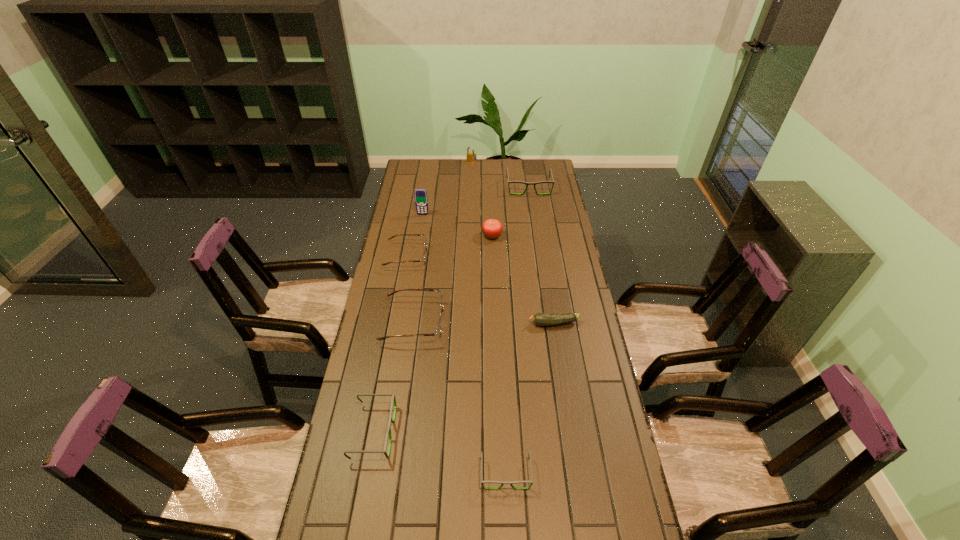
Locate which black spectacles is the third closest to the apple. Please provide its 2D coordinates. Your answer should be formatted as a tuple, i.e. [(x, y)], where the tuple contains the x and y coordinates of a point satisfying the conditions above.

[(502, 483)]

Locate which brown spectacles is the closest to the red apple. Please provide its 2D coordinates. Your answer should be formatted as a tuple, i.e. [(x, y)], where the tuple contains the x and y coordinates of a point satisfying the conditions above.

[(423, 260)]

Select which brown spectacles appears as the second closest to the second biggest black spectacles. Please provide its 2D coordinates. Your answer should be formatted as a tuple, i.e. [(x, y)], where the tuple contains the x and y coordinates of a point satisfying the conditions above.

[(423, 260)]

The width and height of the screenshot is (960, 540). Find the location of `free space that satisfies the following two spatial constraints: 1. on the front-facing side of the seventh nearest object; 2. on the left side of the red apple`. free space that satisfies the following two spatial constraints: 1. on the front-facing side of the seventh nearest object; 2. on the left side of the red apple is located at coordinates (420, 236).

Locate an element on the screen. The height and width of the screenshot is (540, 960). free space that satisfies the following two spatial constraints: 1. on the front side of the fourth farthest object; 2. on the lens of the second smallest black spectacles is located at coordinates (498, 431).

This screenshot has width=960, height=540. Identify the location of free region that satisfies the following two spatial constraints: 1. on the lens of the biggest black spectacles; 2. on the front-facing side of the smaller brown spectacles. (539, 256).

What are the coordinates of `free location that satisfies the following two spatial constraints: 1. on the side with the combination dials of the padlock; 2. on the front-facing side of the farther brown spectacles` in the screenshot? It's located at (469, 256).

The width and height of the screenshot is (960, 540). Find the location of `free space that satisfies the following two spatial constraints: 1. on the lens of the farthest black spectacles; 2. on the lens of the second biggest black spectacles`. free space that satisfies the following two spatial constraints: 1. on the lens of the farthest black spectacles; 2. on the lens of the second biggest black spectacles is located at coordinates (564, 431).